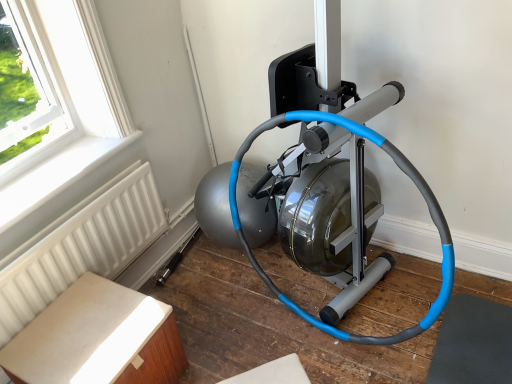
Question: Based on their positions, is light brown wood table at lower left located to the left or right of white textured radiator at lower left?

Choices:
 (A) left
 (B) right

Answer: (B)

Question: Is point (50, 332) closer or farther from the camera than point (97, 268)?

Choices:
 (A) farther
 (B) closer

Answer: (B)

Question: Considering the real-world distances, which object is closest to the white plastic radiator at lower left?

Choices:
 (A) blue rubber garden hose at center
 (B) white textured radiator at lower left
 (C) light brown wood table at lower left

Answer: (B)

Question: Which is farther from the white textured radiator at lower left?

Choices:
 (A) white plastic radiator at lower left
 (B) blue rubber garden hose at center
 (C) light brown wood table at lower left

Answer: (B)